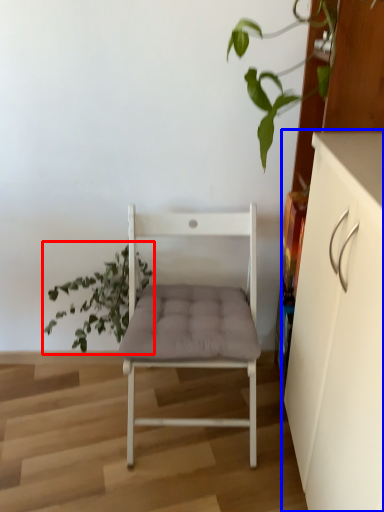
Question: Which object appears closest to the camera in this image, houseplant (highlighted by a red box) or cabinetry (highlighted by a blue box)?

Choices:
 (A) houseplant
 (B) cabinetry

Answer: (B)